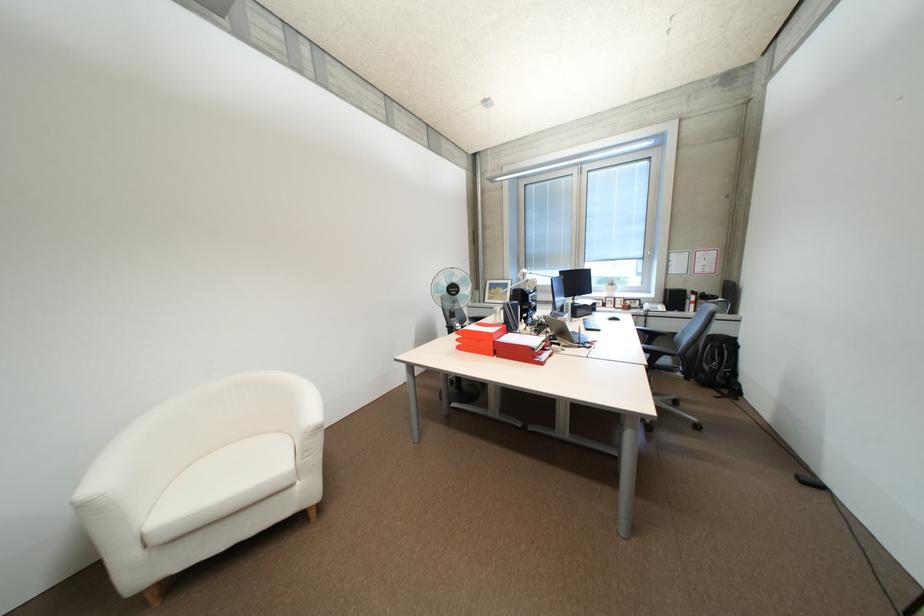
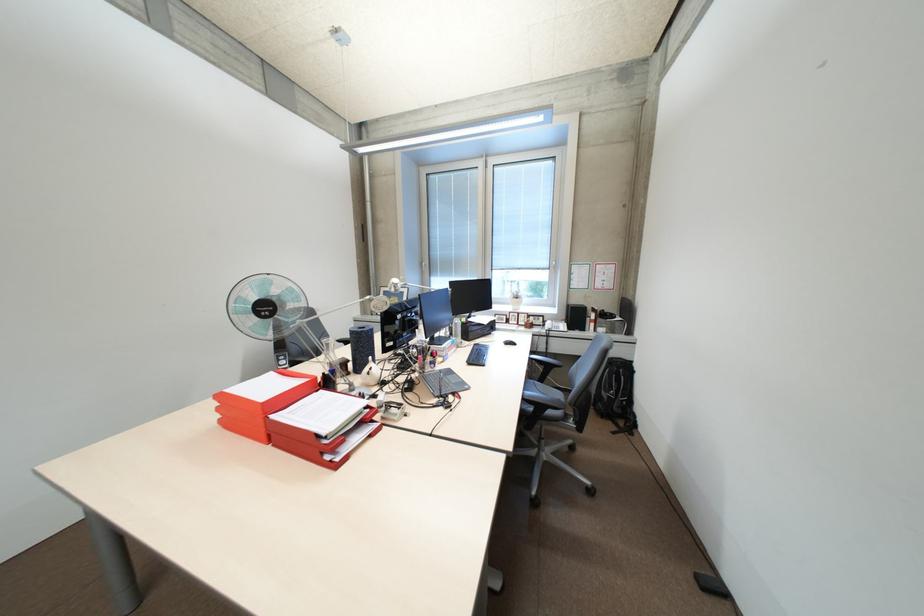
In the second image, find the point that corresponds to (609,318) in the first image.

(504, 341)